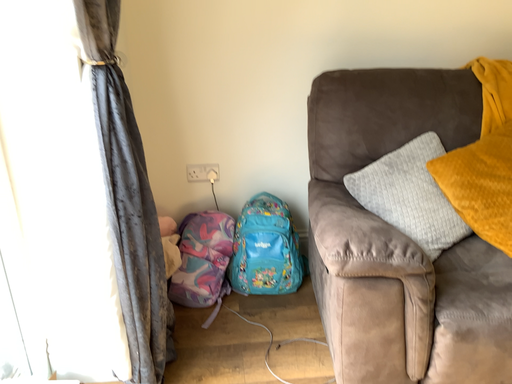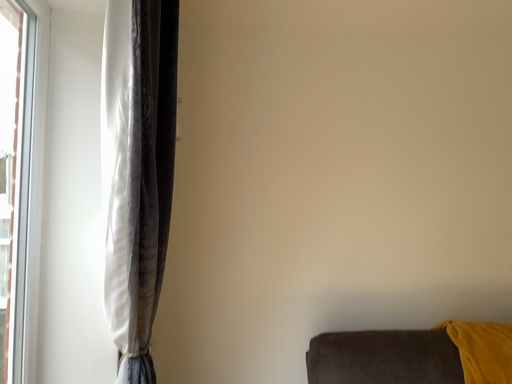
Question: How did the camera likely rotate when shooting the video?

Choices:
 (A) rotated upward
 (B) rotated downward

Answer: (A)